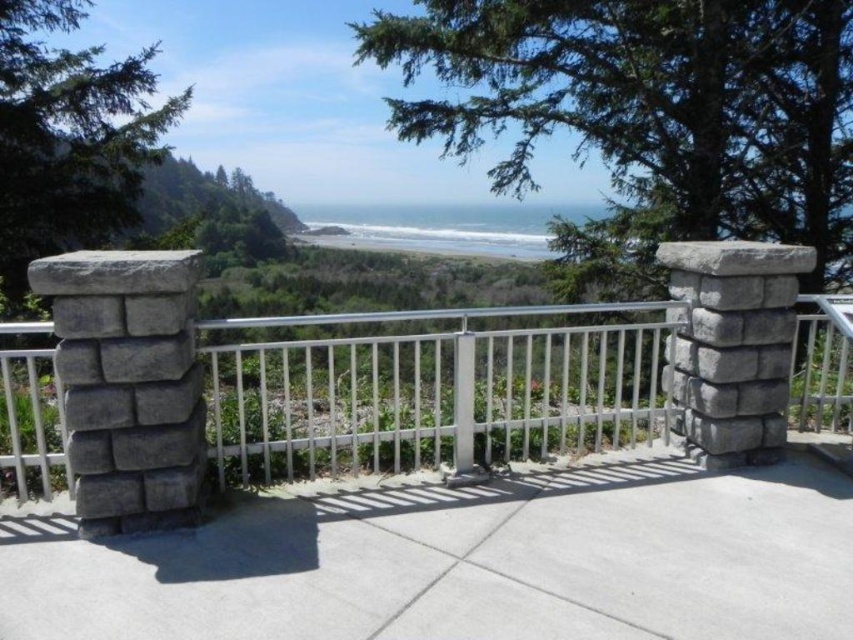
Question: Is gray concrete deck at center bigger than white metal fence at center?

Choices:
 (A) no
 (B) yes

Answer: (A)

Question: Estimate the real-world distances between objects in this image. Which object is farther from the gray concrete deck at center?

Choices:
 (A) blue water at center
 (B) white metal fence at center

Answer: (A)

Question: Can you confirm if gray concrete deck at center is positioned below white metal fence at center?

Choices:
 (A) no
 (B) yes

Answer: (B)

Question: Which point is closer to the camera taking this photo?

Choices:
 (A) (407, 508)
 (B) (589, 369)
 (C) (392, 236)

Answer: (A)

Question: Estimate the real-world distances between objects in this image. Which object is farther from the white metal fence at center?

Choices:
 (A) blue water at center
 (B) gray concrete deck at center

Answer: (A)

Question: Does white metal fence at center appear on the left side of blue water at center?

Choices:
 (A) no
 (B) yes

Answer: (B)